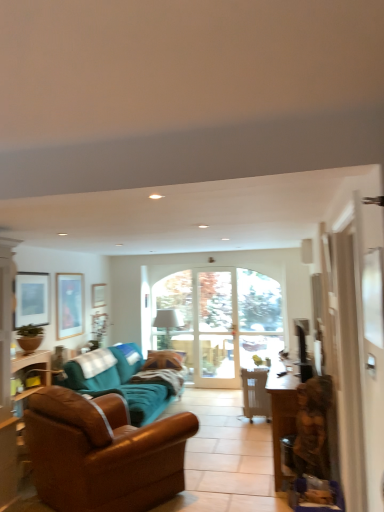
Question: From their relative heights in the image, would you say metallic silver chair at center is taller or shorter than matte wooden picture frame at upper left, the third picture frame viewed from the left?

Choices:
 (A) short
 (B) tall

Answer: (B)

Question: Is point (x=258, y=375) closer or farther from the camera than point (x=104, y=302)?

Choices:
 (A) farther
 (B) closer

Answer: (B)

Question: Estimate the real-world distances between objects in this image. Which object is farther from the clear glass door at center?

Choices:
 (A) matte wooden picture frame at upper left, which is counted as the 1th picture frame, starting from the back
 (B) metallic silver chair at center
 (C) teal fabric couch at center, which is counted as the first studio couch, starting from the back
 (D) matte black picture frame at upper left, the 1th picture frame in the left-to-right sequence
 (E) wooden statue at right

Answer: (E)

Question: Estimate the real-world distances between objects in this image. Which object is farther from the satin black television at right?

Choices:
 (A) brown leather couch at lower left, which appears as the first studio couch when viewed from the front
 (B) matte wooden picture frame at upper left, arranged as the 1th picture frame when viewed from the right
 (C) teal fabric couch at center, which is the second studio couch in front-to-back order
 (D) matte black picture frame at upper left, the 3th picture frame positioned from the right
 (E) matte glass picture frame at left, the 2th picture frame when ordered from front to back

Answer: (D)